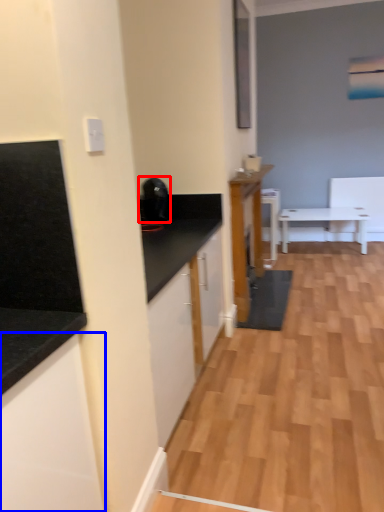
Question: Which of the following is the closest to the observer, appliance (highlighted by a red box) or cabinetry (highlighted by a blue box)?

Choices:
 (A) appliance
 (B) cabinetry

Answer: (B)